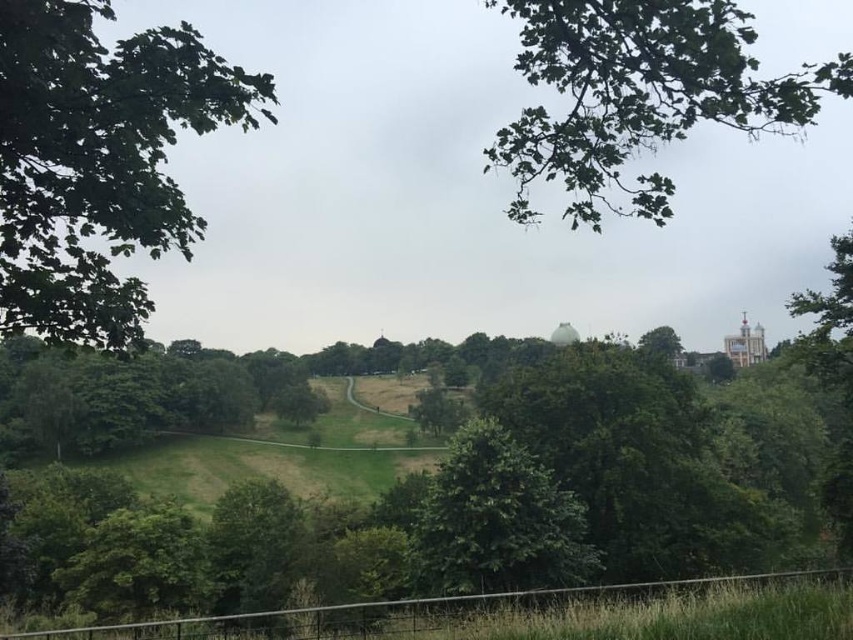
Describe the element at coordinates (639, 93) in the screenshot. The image size is (853, 640). I see `green leafy tree at upper right` at that location.

Does point (746, 115) come farther from viewer compared to point (482, 456)?

Yes, point (746, 115) is farther from viewer.

Find the location of a particular element. The image size is (853, 640). green leafy tree at upper right is located at coordinates (639, 93).

The image size is (853, 640). In order to click on green leafy tree at left in this screenshot , I will do `click(97, 161)`.

Find the location of a particular element. green leafy tree at left is located at coordinates (97, 161).

Can you confirm if green leafy tree at left is positioned to the left of green leafy tree at upper right?

Yes, green leafy tree at left is to the left of green leafy tree at upper right.

Is green leafy tree at left bigger than green leafy tree at upper right?

No.

Where is `green leafy tree at left`? Image resolution: width=853 pixels, height=640 pixels. green leafy tree at left is located at coordinates (97, 161).